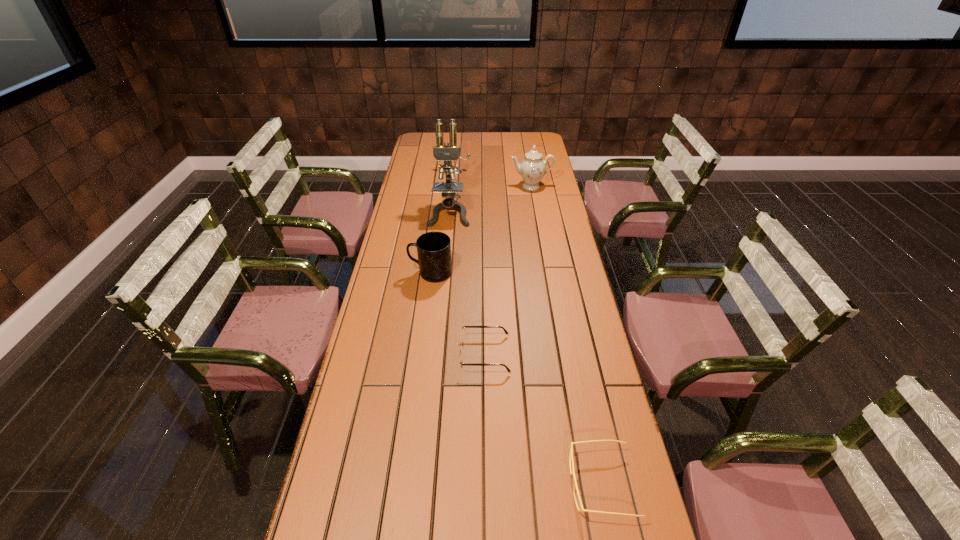
This screenshot has width=960, height=540. I want to click on empty space between the fourth farthest object and the nearest object, so click(516, 379).

Find the location of a particular element. This screenshot has height=540, width=960. vacant area that lies between the chinaware and the left spectacles is located at coordinates (508, 271).

The image size is (960, 540). What are the coordinates of `vacant area that lies between the mug and the nearer spectacles` in the screenshot? It's located at (516, 379).

This screenshot has width=960, height=540. Identify the location of vacant area between the second farthest object and the candle. (493, 179).

You are a GUI agent. You are given a task and a screenshot of the screen. Output one action in this format:
    pyautogui.click(x=<x>, y=<y>)
    Task: Click on the unoccupied area between the candle and the fifth shortest object
    Image resolution: width=960 pixels, height=540 pixels.
    Given the screenshot: What is the action you would take?
    pyautogui.click(x=493, y=179)

At what (x,y) coordinates should I click in order to perform the action: click on vacant area that lies between the farthest object and the nearer spectacles. Please return your answer as a coordinate pair (x, y). The width and height of the screenshot is (960, 540). Looking at the image, I should click on (529, 328).

The height and width of the screenshot is (540, 960). In order to click on free space between the fifth nearest object and the nearest object in this screenshot , I will do `click(566, 335)`.

Identify the location of free space between the left spectacles and the nearest object. (542, 419).

I want to click on object identified as the third closest to the tallest object, so click(x=457, y=171).

The height and width of the screenshot is (540, 960). In order to click on object that is the third closest one to the microscope in this screenshot , I will do `click(457, 171)`.